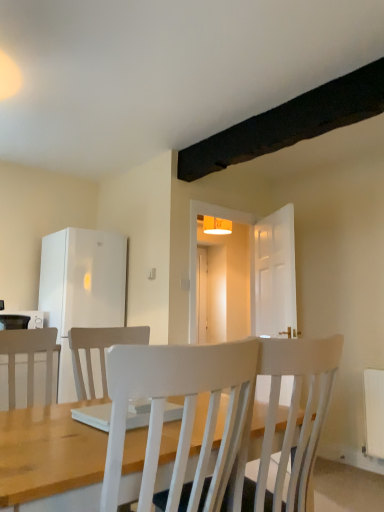
Question: Is white glossy microwave at left closer to camera compared to white matte refrigerator at left?

Choices:
 (A) no
 (B) yes

Answer: (B)

Question: Is white matte refrigerator at left completely or partially inside white glossy microwave at left?

Choices:
 (A) yes
 (B) no

Answer: (B)

Question: Can you confirm if white glossy microwave at left is bigger than white matte refrigerator at left?

Choices:
 (A) yes
 (B) no

Answer: (B)

Question: Is white glossy microwave at left oriented away from white matte refrigerator at left?

Choices:
 (A) yes
 (B) no

Answer: (B)

Question: From a real-world perspective, is white glossy microwave at left physically below white matte refrigerator at left?

Choices:
 (A) yes
 (B) no

Answer: (A)

Question: Relative to white glossy microwave at left, is white matte refrigerator at left in front or behind?

Choices:
 (A) behind
 (B) front

Answer: (A)

Question: From the image's perspective, is white matte refrigerator at left above or below white glossy microwave at left?

Choices:
 (A) below
 (B) above

Answer: (B)

Question: Looking at their shapes, would you say white matte refrigerator at left is wider or thinner than white glossy microwave at left?

Choices:
 (A) wide
 (B) thin

Answer: (A)

Question: Does point (87, 320) appear closer or farther from the camera than point (36, 310)?

Choices:
 (A) farther
 (B) closer

Answer: (B)

Question: Considering the positions of point (107, 374) and point (29, 325), is point (107, 374) closer or farther from the camera than point (29, 325)?

Choices:
 (A) farther
 (B) closer

Answer: (B)

Question: Looking at their shapes, would you say white textured chair at center is wider or thinner than white glossy microwave at left?

Choices:
 (A) thin
 (B) wide

Answer: (B)

Question: From the image's perspective, is white textured chair at center above or below white glossy microwave at left?

Choices:
 (A) above
 (B) below

Answer: (B)

Question: From a real-world perspective, relative to white glossy microwave at left, is white textured chair at center vertically above or below?

Choices:
 (A) below
 (B) above

Answer: (A)

Question: Is white matte refrigerator at left inside or outside of white textured chair at center?

Choices:
 (A) inside
 (B) outside

Answer: (B)

Question: From the image's perspective, is white matte refrigerator at left above or below white textured chair at center?

Choices:
 (A) above
 (B) below

Answer: (A)